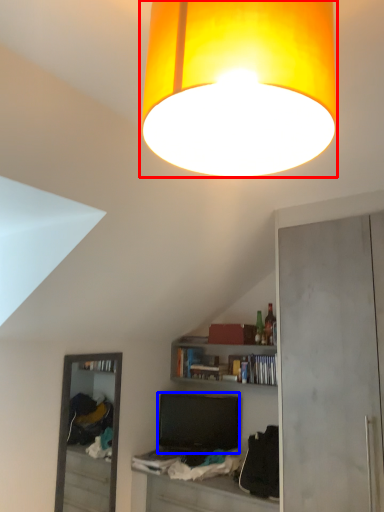
Question: Which object appears closest to the camera in this image, lamp (highlighted by a red box) or television (highlighted by a blue box)?

Choices:
 (A) lamp
 (B) television

Answer: (A)